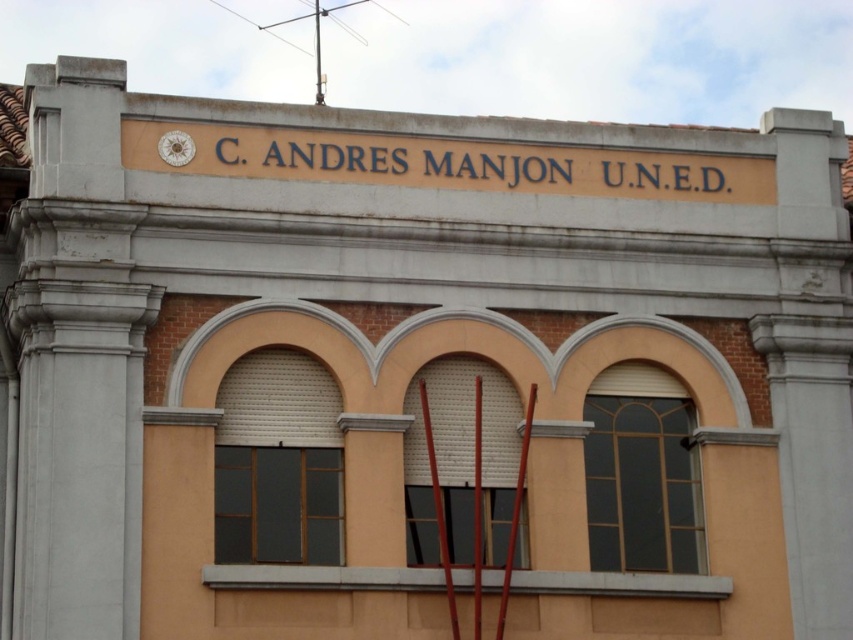
Between goldmaterial/texturesign at upper center and gold metallic clock at upper center, which one is positioned lower?

goldmaterial/texturesign at upper center

What do you see at coordinates (451, 163) in the screenshot? I see `goldmaterial/texturesign at upper center` at bounding box center [451, 163].

Who is more distant from viewer, (436, 157) or (160, 152)?

The point (436, 157) is more distant.

You are a GUI agent. You are given a task and a screenshot of the screen. Output one action in this format:
    pyautogui.click(x=<x>, y=<y>)
    Task: Click on the goldmaterial/texturesign at upper center
    This screenshot has height=640, width=853.
    Given the screenshot: What is the action you would take?
    pyautogui.click(x=451, y=163)